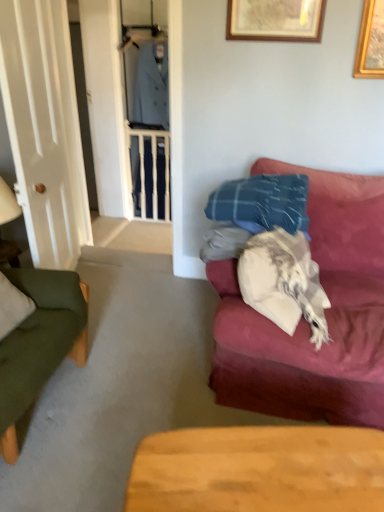
Question: Is white glossy door at left located outside wooden table at lower center?

Choices:
 (A) no
 (B) yes

Answer: (B)

Question: Can you confirm if white glossy door at left is taller than wooden table at lower center?

Choices:
 (A) yes
 (B) no

Answer: (A)

Question: Considering the relative sizes of white glossy door at left and wooden table at lower center in the image provided, is white glossy door at left thinner than wooden table at lower center?

Choices:
 (A) no
 (B) yes

Answer: (B)

Question: From the image's perspective, is white glossy door at left under wooden table at lower center?

Choices:
 (A) no
 (B) yes

Answer: (A)

Question: Are white glossy door at left and wooden table at lower center located far from each other?

Choices:
 (A) yes
 (B) no

Answer: (A)

Question: Is white glossy door at left oriented away from wooden table at lower center?

Choices:
 (A) no
 (B) yes

Answer: (A)

Question: Does wooden balustrade at center lie behind white glossy door at left?

Choices:
 (A) yes
 (B) no

Answer: (A)

Question: Can you confirm if wooden balustrade at center is wider than white glossy door at left?

Choices:
 (A) yes
 (B) no

Answer: (B)

Question: Is white glossy door at left located within wooden balustrade at center?

Choices:
 (A) no
 (B) yes

Answer: (A)

Question: Is wooden balustrade at center not close to white glossy door at left?

Choices:
 (A) no
 (B) yes

Answer: (B)

Question: Is the position of wooden balustrade at center less distant than that of white glossy door at left?

Choices:
 (A) no
 (B) yes

Answer: (A)

Question: Does wooden balustrade at center have a lesser width compared to white glossy door at left?

Choices:
 (A) yes
 (B) no

Answer: (A)

Question: From the image's perspective, is wooden table at lower center beneath white glossy door at left?

Choices:
 (A) yes
 (B) no

Answer: (A)